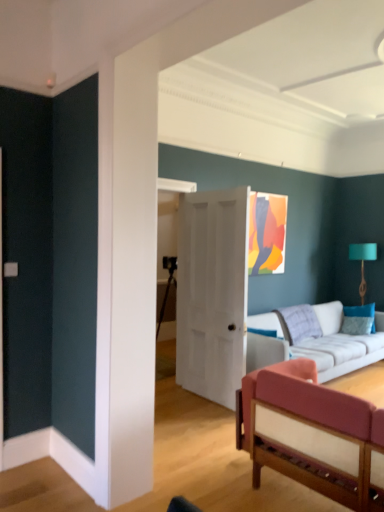
Identify the location of vacant region to the left of white matte door at center. coord(175,403).